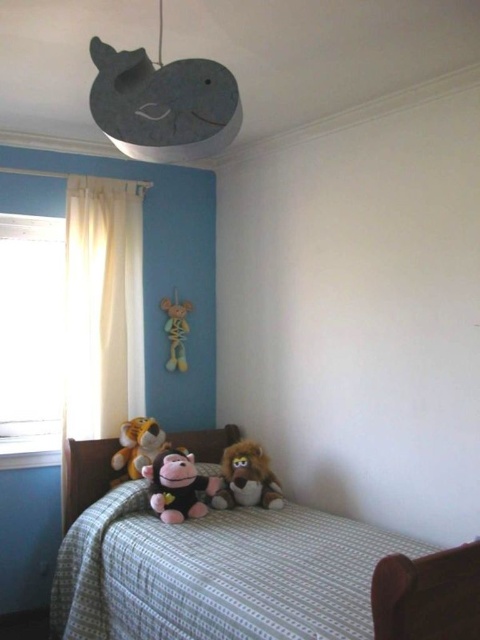
Question: Does white sheer curtain at left have a lesser width compared to soft plush tiger at center?

Choices:
 (A) no
 (B) yes

Answer: (A)

Question: Estimate the real-world distances between objects in this image. Which object is closer to the yellow fabric skeleton at center?

Choices:
 (A) white sheer curtain at left
 (B) black plush monkey at center

Answer: (A)

Question: Can you confirm if black plush monkey at center is thinner than yellow fabric skeleton at center?

Choices:
 (A) yes
 (B) no

Answer: (B)

Question: Considering the real-world distances, which object is closest to the soft plush lion at center?

Choices:
 (A) yellow fabric skeleton at center
 (B) white sheer curtain at left

Answer: (A)

Question: Which of the following is the farthest from the observer?

Choices:
 (A) soft plush tiger at center
 (B) yellow fabric skeleton at center
 (C) checkered fabric bed at lower center
 (D) white sheer curtain at left

Answer: (B)

Question: Can you confirm if checkered fabric bed at lower center is thinner than white sheer curtain at left?

Choices:
 (A) no
 (B) yes

Answer: (A)